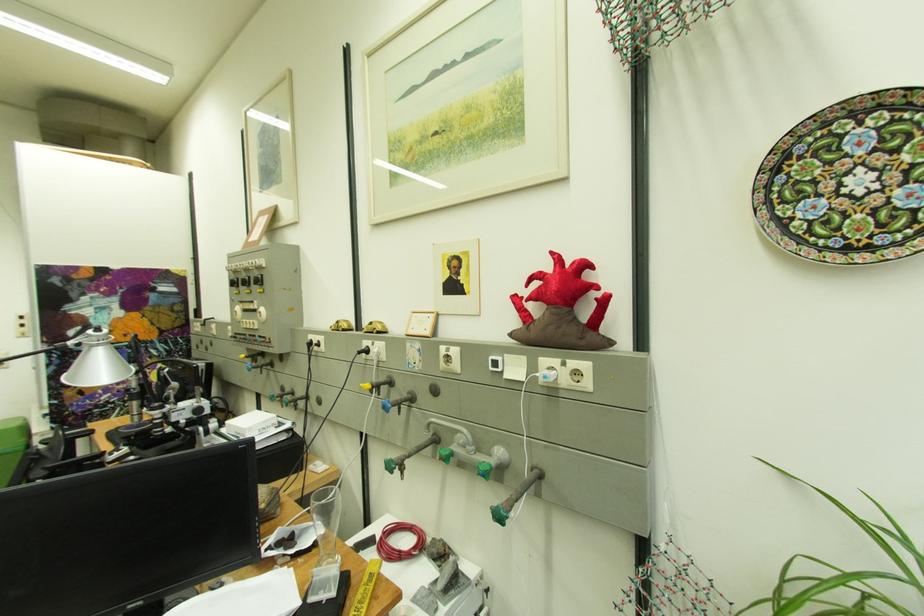
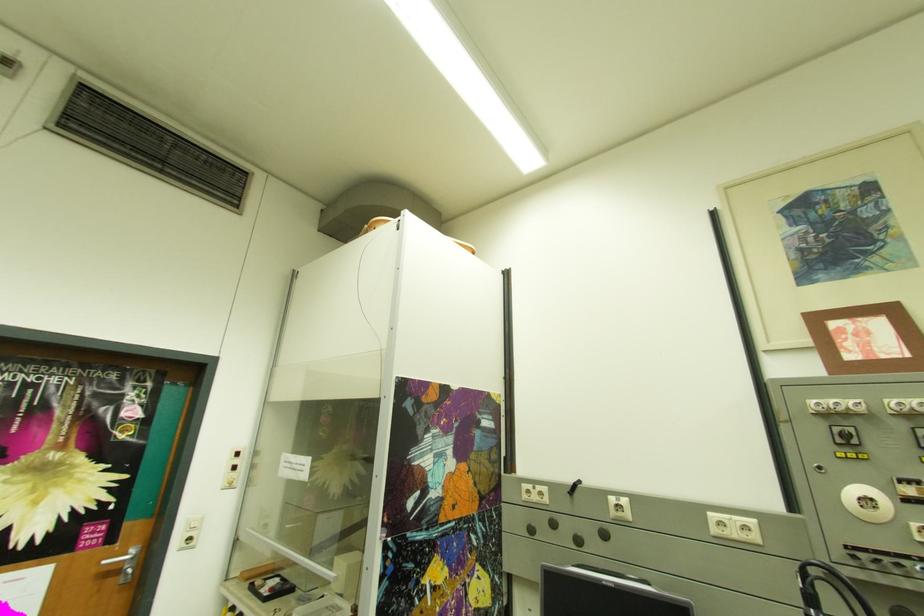
Question: Which direction would the cameraman need to move to produce the second image? Reply with the corresponding letter.

Choices:
 (A) Left
 (B) Right
 (C) Forward
 (D) Backward

Answer: (A)